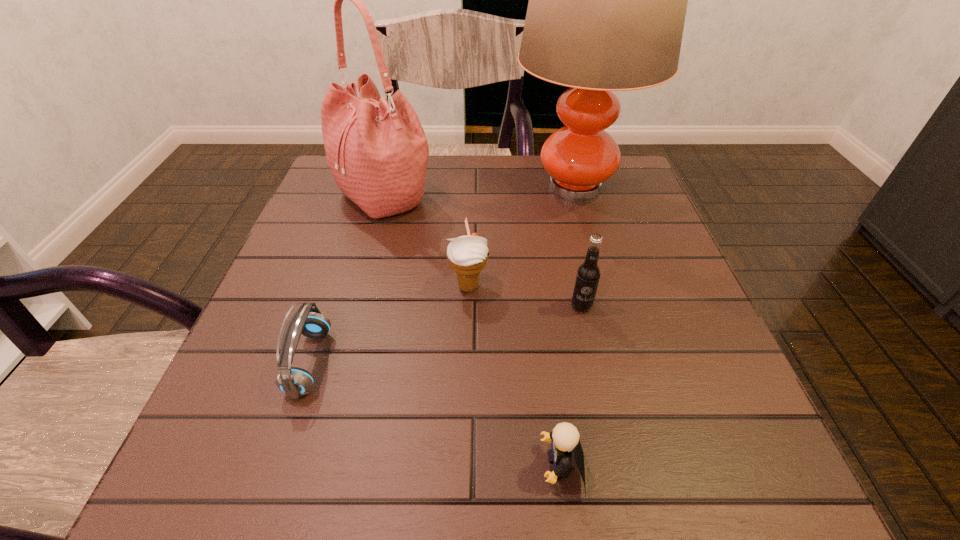
The width and height of the screenshot is (960, 540). What are the coordinates of `vacant space in between the Lego and the handbag` in the screenshot? It's located at (473, 330).

In order to click on vacant area that lies between the tallest object and the root beer in this screenshot , I will do `click(578, 246)`.

What are the coordinates of `free space that is in between the icecream and the Lego` in the screenshot? It's located at (516, 376).

Where is `free space between the nearest object and the second nearest object`? free space between the nearest object and the second nearest object is located at coordinates (436, 414).

Where is `free spot between the fifth farthest object and the lamp`? This screenshot has height=540, width=960. free spot between the fifth farthest object and the lamp is located at coordinates pos(443,274).

In order to click on vacant point located between the second nearest object and the root beer in this screenshot , I will do `click(445, 334)`.

Where is `free space between the fourth tallest object and the fifth shortest object`? The height and width of the screenshot is (540, 960). free space between the fourth tallest object and the fifth shortest object is located at coordinates (426, 241).

Image resolution: width=960 pixels, height=540 pixels. Find the location of `empty space that is in between the third shortest object and the second nearest object`. empty space that is in between the third shortest object and the second nearest object is located at coordinates (389, 325).

Identify which object is located as the nearest to the nearest object. Please provide its 2D coordinates. Your answer should be formatted as a tuple, i.e. [(x, y)], where the tuple contains the x and y coordinates of a point satisfying the conditions above.

[(588, 273)]

Where is `object that is the fourth closest to the tallest object`? This screenshot has width=960, height=540. object that is the fourth closest to the tallest object is located at coordinates (295, 382).